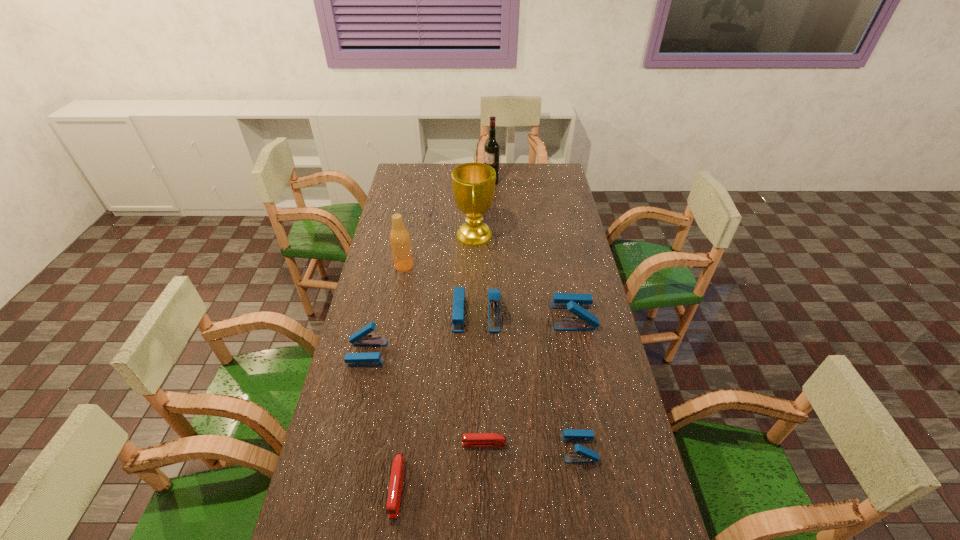
Identify the location of free space located 0.240m on the shiny surface of the golden award. The width and height of the screenshot is (960, 540). (550, 234).

The height and width of the screenshot is (540, 960). I want to click on free space located on the front of the third farthest object, so click(x=398, y=294).

The image size is (960, 540). In order to click on vacant space located 0.400m on the front of the sixth shortest object in this screenshot , I will do `click(475, 446)`.

Image resolution: width=960 pixels, height=540 pixels. What are the coordinates of `vacant area located on the front of the second biggest blue stapler` in the screenshot? It's located at (592, 407).

You are a GUI agent. You are given a task and a screenshot of the screen. Output one action in this format:
    pyautogui.click(x=<x>, y=<y>)
    Task: Click on the free space located 0.370m on the front of the fourth nearest object
    
    Given the screenshot: What is the action you would take?
    pyautogui.click(x=336, y=486)

At what (x,y) coordinates should I click in order to perform the action: click on vacant space located 0.060m on the back of the third shortest object. Please return your answer as a coordinate pair (x, y). Looking at the image, I should click on (573, 415).

Identify the location of vacant area situated 0.280m on the front-facing side of the farther red stapler. (361, 444).

You are a GUI agent. You are given a task and a screenshot of the screen. Output one action in this format:
    pyautogui.click(x=<x>, y=<y>)
    Task: Click on the vacant space located on the front-facing side of the farther red stapler
    This screenshot has width=960, height=540.
    Given the screenshot: What is the action you would take?
    pyautogui.click(x=365, y=444)

Where is `vacant space located 0.280m on the front-facing side of the farther red stapler`? vacant space located 0.280m on the front-facing side of the farther red stapler is located at coordinates (361, 444).

Identify the location of object present at the far edge. The height and width of the screenshot is (540, 960). (492, 147).